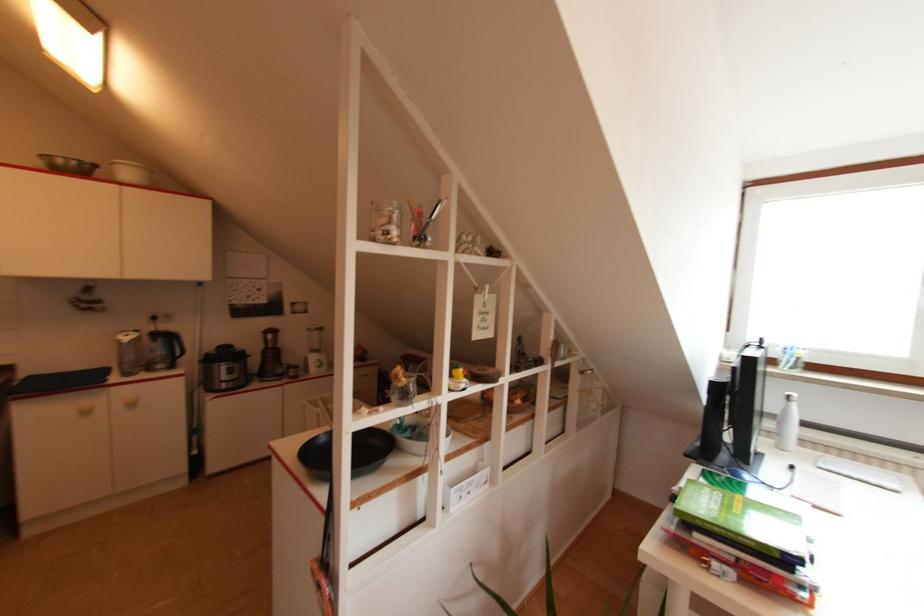
Where is `green book`? The width and height of the screenshot is (924, 616). green book is located at coordinates (744, 521).